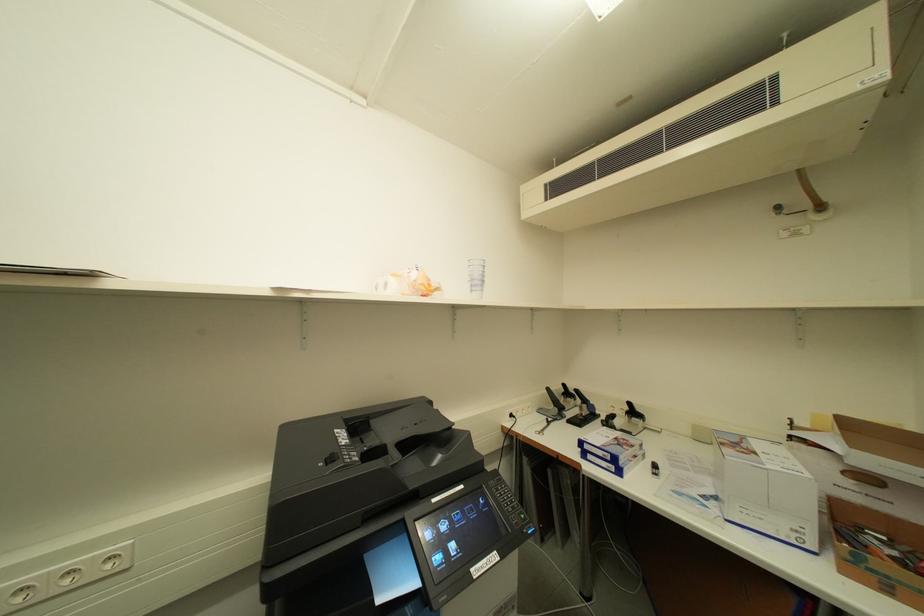
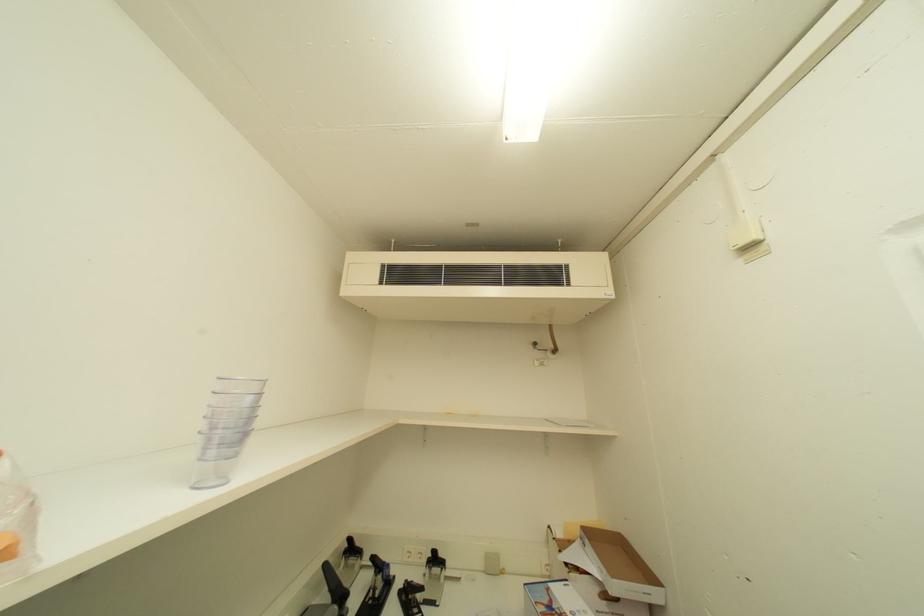
Looking at this image, the first image is from the beginning of the video and the second image is from the end. How did the camera likely rotate when shooting the video?

The camera's rotation is toward right-up.